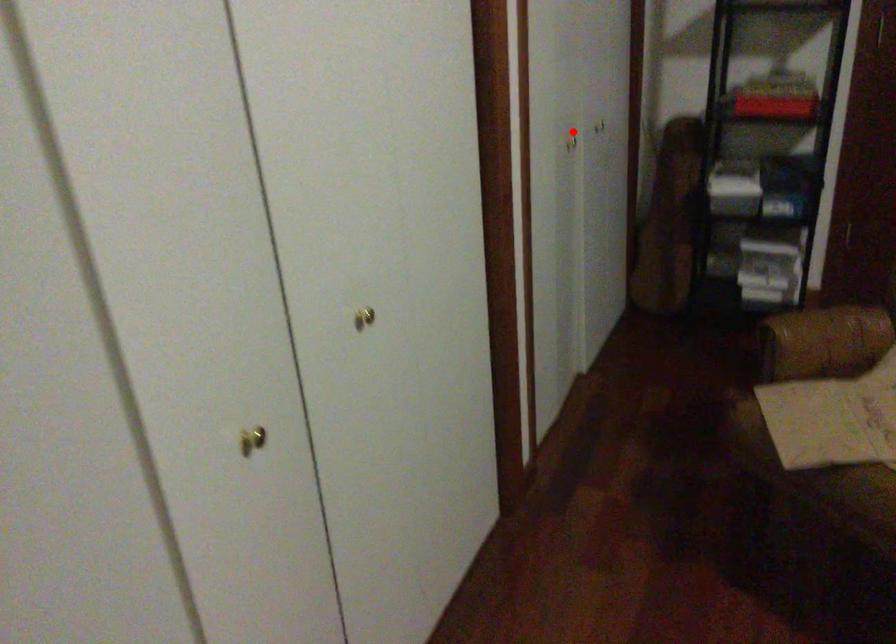
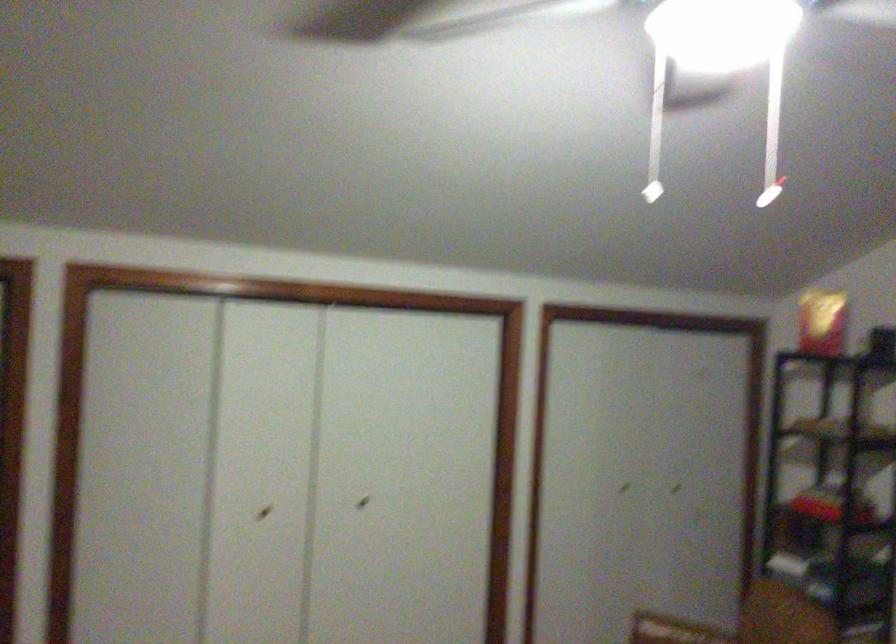
Where in the second image is the point corresponding to the highlighted location from the first image?

(623, 488)